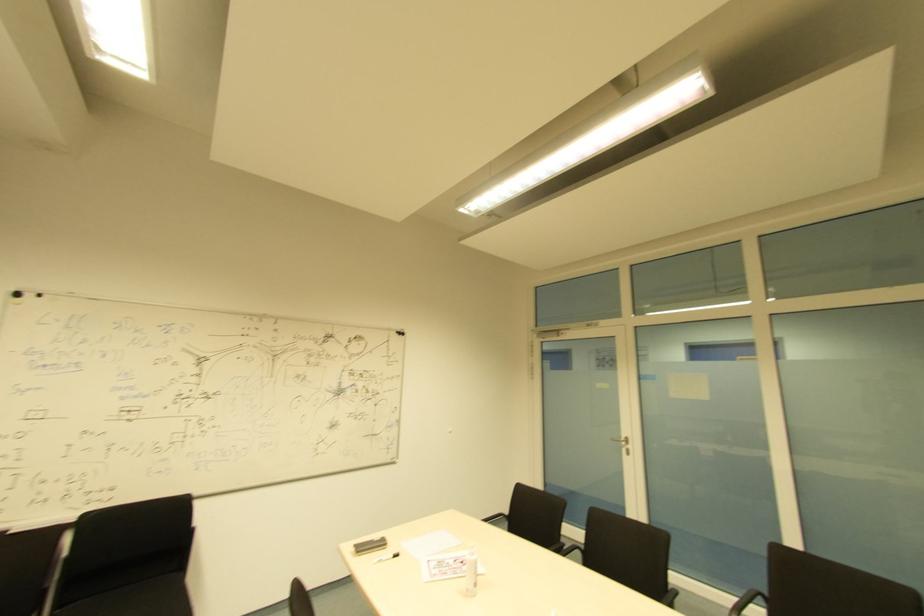
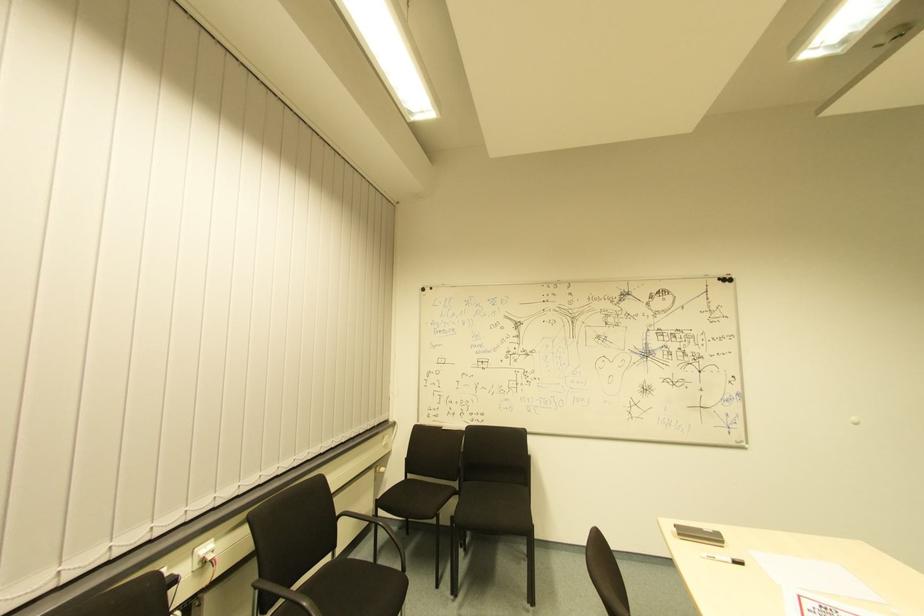
Question: The images are taken continuously from a first-person perspective. In which direction is your viewpoint rotating?

Choices:
 (A) Left
 (B) Right
 (C) Up
 (D) Down

Answer: (A)